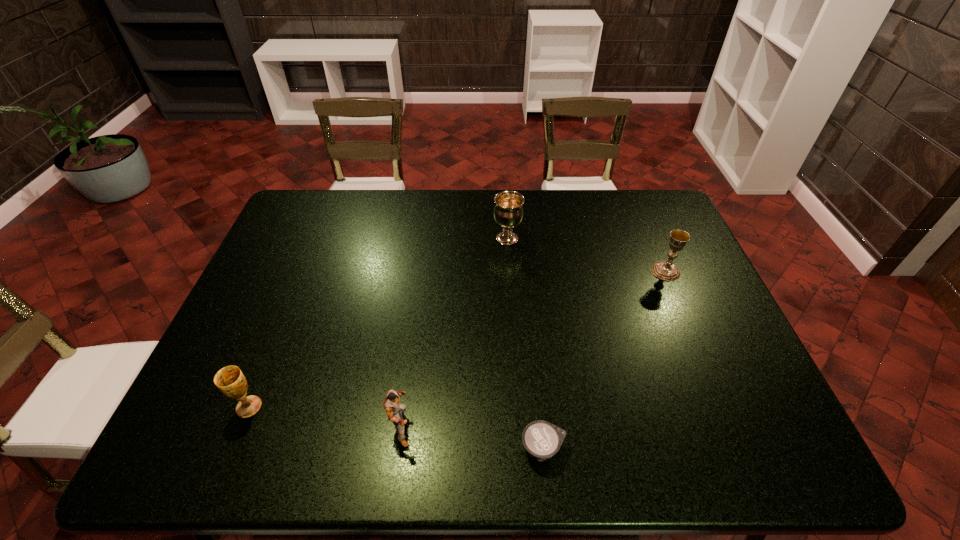
Where is `free location that satisfies the following two spatial constraints: 1. on the front-facing side of the puncher; 2. on the right side of the yogurt`? free location that satisfies the following two spatial constraints: 1. on the front-facing side of the puncher; 2. on the right side of the yogurt is located at coordinates (398, 449).

What are the coordinates of `vacant position in the image that satisfies the following two spatial constraints: 1. on the front-facing side of the yogurt; 2. on the left side of the puncher` in the screenshot? It's located at (398, 449).